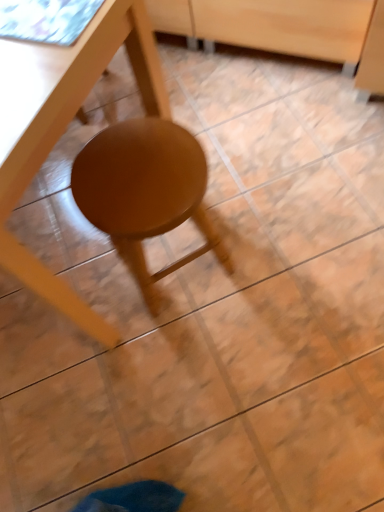
Question: Considering the relative sizes of matte wood stool at center and wooden drawer at center in the image provided, is matte wood stool at center thinner than wooden drawer at center?

Choices:
 (A) yes
 (B) no

Answer: (A)

Question: From the image's perspective, is matte wood stool at center under wooden drawer at center?

Choices:
 (A) no
 (B) yes

Answer: (B)

Question: Considering the relative sizes of matte wood stool at center and wooden drawer at center in the image provided, is matte wood stool at center wider than wooden drawer at center?

Choices:
 (A) no
 (B) yes

Answer: (A)

Question: From a real-world perspective, is matte wood stool at center located beneath wooden drawer at center?

Choices:
 (A) no
 (B) yes

Answer: (A)

Question: Does matte wood stool at center come behind wooden drawer at center?

Choices:
 (A) no
 (B) yes

Answer: (A)

Question: Is wooden drawer at center at the back of matte wood stool at center?

Choices:
 (A) no
 (B) yes

Answer: (A)

Question: Is wooden drawer at center positioned beyond the bounds of matte wood table at center?

Choices:
 (A) no
 (B) yes

Answer: (B)

Question: Is wooden drawer at center to the left of matte wood table at center from the viewer's perspective?

Choices:
 (A) yes
 (B) no

Answer: (B)

Question: From a real-world perspective, is wooden drawer at center physically above matte wood table at center?

Choices:
 (A) no
 (B) yes

Answer: (A)

Question: Does wooden drawer at center have a larger size compared to matte wood table at center?

Choices:
 (A) yes
 (B) no

Answer: (B)

Question: Is wooden drawer at center far away from matte wood table at center?

Choices:
 (A) no
 (B) yes

Answer: (A)

Question: Is wooden drawer at center positioned in front of matte wood table at center?

Choices:
 (A) no
 (B) yes

Answer: (A)

Question: Does matte wood stool at center have a greater height compared to matte wood table at center?

Choices:
 (A) no
 (B) yes

Answer: (A)